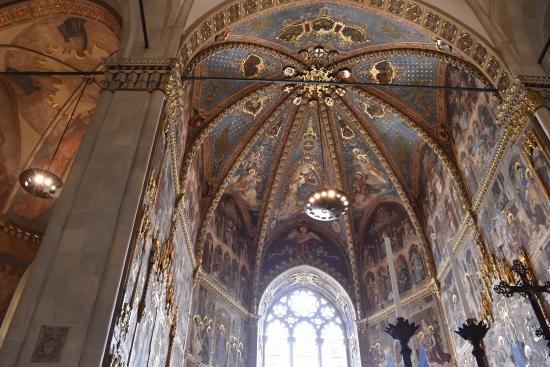
Where is `painting`? Image resolution: width=550 pixels, height=367 pixels. painting is located at coordinates [515, 197], [212, 241], [482, 138], [426, 199], [396, 243], [292, 248].